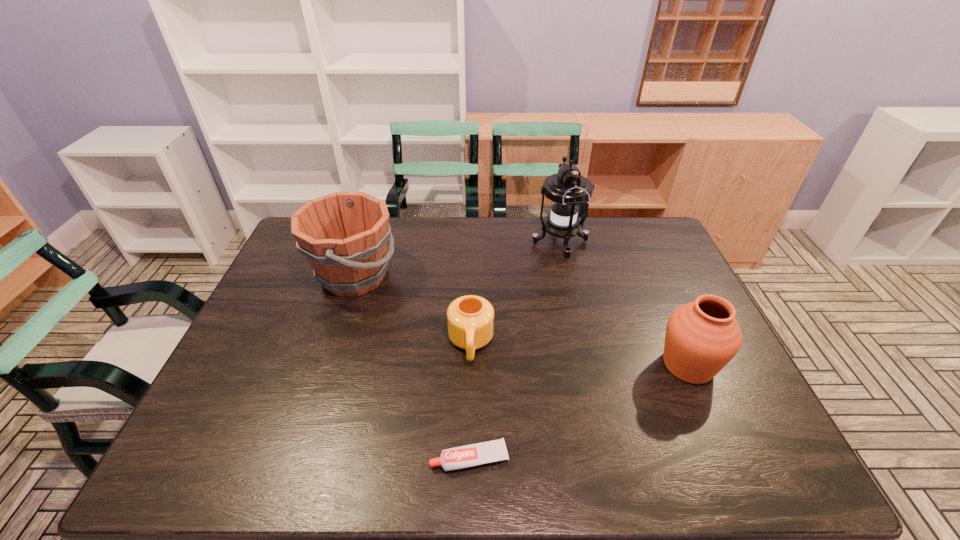
The height and width of the screenshot is (540, 960). Identify the location of free space at the left edge. (308, 280).

Find the location of a particular element. Image resolution: width=960 pixels, height=540 pixels. vacant space at the right edge of the desktop is located at coordinates (669, 285).

Where is `free space at the near left corner of the desktop`? The width and height of the screenshot is (960, 540). free space at the near left corner of the desktop is located at coordinates point(183,475).

Image resolution: width=960 pixels, height=540 pixels. Identify the location of vacant space at the near right corner of the desktop. (747, 477).

The width and height of the screenshot is (960, 540). In order to click on empty space that is in between the urn and the toothpaste in this screenshot , I will do `click(579, 411)`.

Locate an element on the screen. This screenshot has height=540, width=960. empty location between the rightmost object and the bucket is located at coordinates (521, 320).

Locate an element on the screen. unoccupied position between the tallest object and the leftmost object is located at coordinates (457, 259).

I want to click on free space between the urn and the tallest object, so click(624, 304).

Find the location of a particular element. This screenshot has height=540, width=960. empty space that is in between the nearest object and the bucket is located at coordinates (412, 367).

This screenshot has width=960, height=540. Find the location of `free space between the mug and the leftmost object`. free space between the mug and the leftmost object is located at coordinates (413, 309).